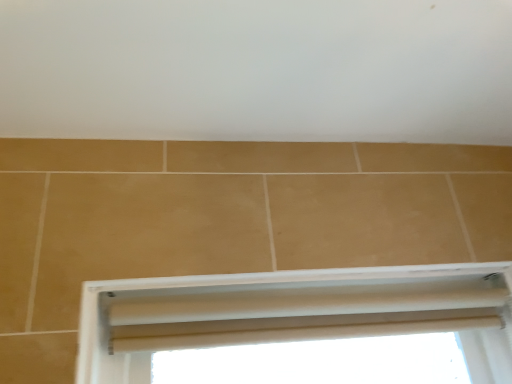
At what (x,y) coordinates should I click in order to perform the action: click on white matte roller blind at center. Please return your answer as a coordinate pair (x, y). This screenshot has width=512, height=384. Looking at the image, I should click on (295, 313).

Describe the element at coordinates (295, 313) in the screenshot. I see `white matte roller blind at center` at that location.

Locate an element on the screen. This screenshot has height=384, width=512. white matte roller blind at center is located at coordinates (295, 313).